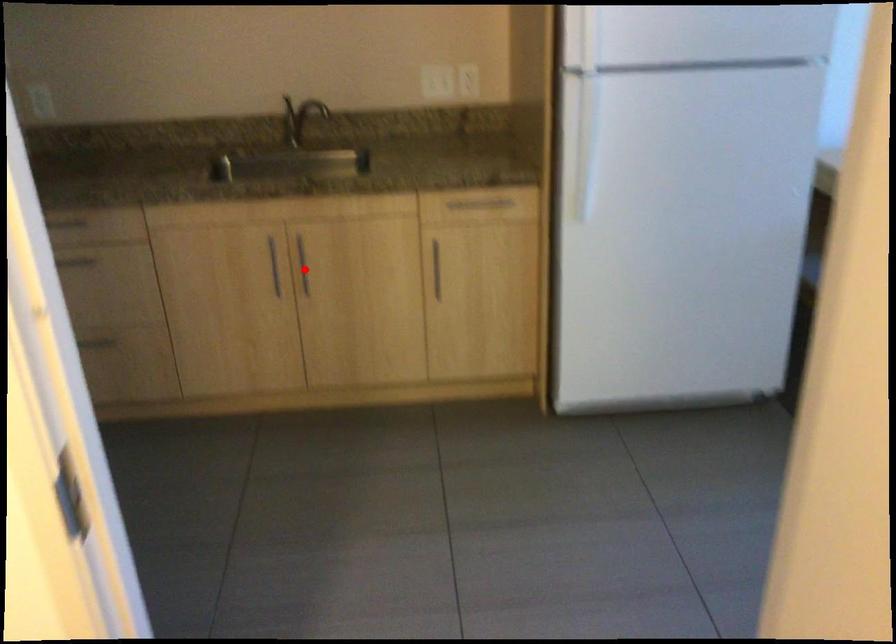
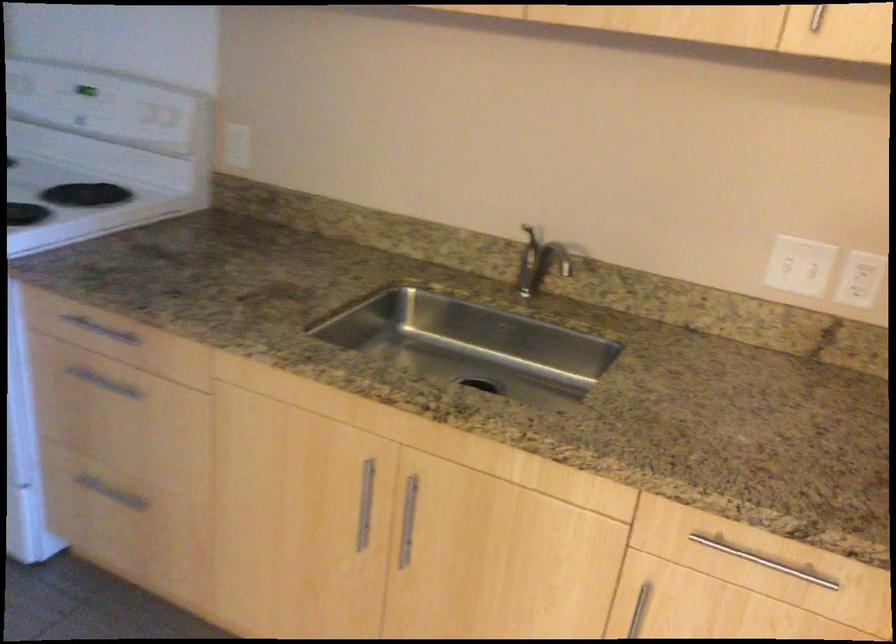
The point at the highlighted location is marked in the first image. Where is the corresponding point in the second image?

(408, 520)